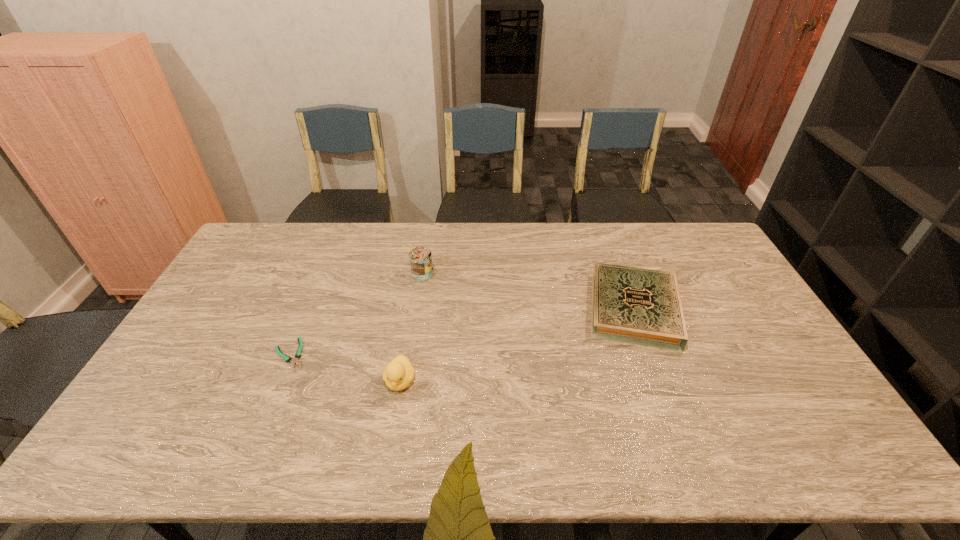
At what (x,y) coordinates should I click in order to perform the action: click on can. Please return your answer as a coordinate pair (x, y). This screenshot has height=540, width=960. Looking at the image, I should click on (420, 258).

This screenshot has height=540, width=960. I want to click on the third shortest object, so click(x=398, y=374).

Where is `the third tallest object`? The height and width of the screenshot is (540, 960). the third tallest object is located at coordinates (638, 306).

Image resolution: width=960 pixels, height=540 pixels. I want to click on the rightmost object, so click(638, 306).

The height and width of the screenshot is (540, 960). I want to click on the leftmost object, so click(298, 354).

Where is `pliers`? pliers is located at coordinates (298, 354).

Identify the location of vacant point located on the front of the tallest object. (414, 322).

This screenshot has width=960, height=540. Find the location of `free region located 0.170m on the front-facing side of the duck`. free region located 0.170m on the front-facing side of the duck is located at coordinates (387, 461).

This screenshot has height=540, width=960. What are the coordinates of `free space located on the left of the second shortest object` in the screenshot? It's located at (x=492, y=309).

Image resolution: width=960 pixels, height=540 pixels. Identify the location of vacant region located on the left of the leftmost object. (241, 354).